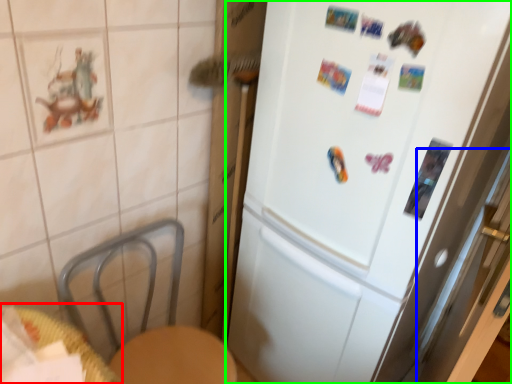
Question: Based on their relative distances, which object is nearer to table (highlighted by a red box)? Choose from screen door (highlighted by a blue box) and refrigerator (highlighted by a green box).

Choices:
 (A) screen door
 (B) refrigerator

Answer: (B)